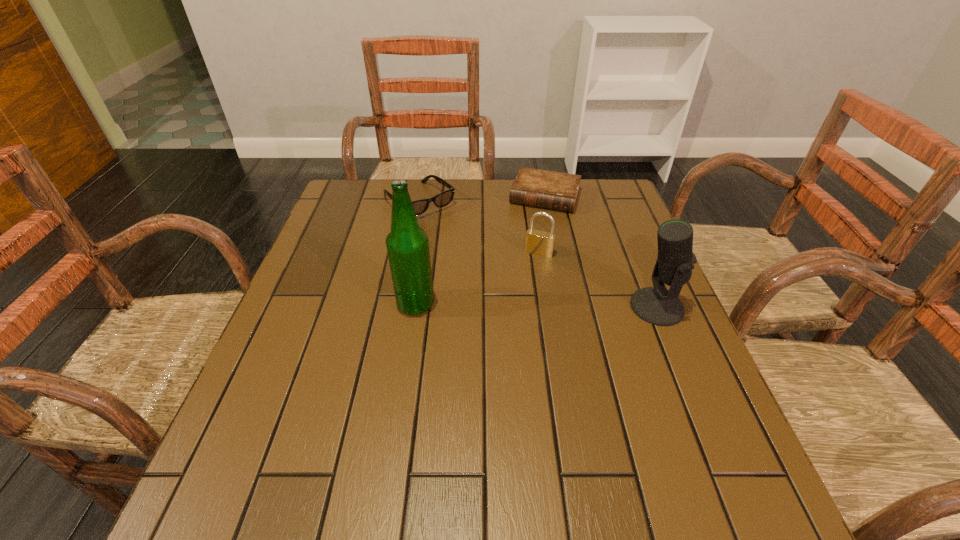
What are the coordinates of `unoccupied position between the shortest object and the spectacles` in the screenshot? It's located at (482, 200).

The width and height of the screenshot is (960, 540). I want to click on empty space between the third tallest object and the shortest object, so click(542, 225).

The image size is (960, 540). In order to click on free area in between the beer bottle and the rightmost object in this screenshot , I will do `click(536, 306)`.

What are the coordinates of `object that stands as the closest to the padlock` in the screenshot? It's located at (546, 189).

The image size is (960, 540). I want to click on the third closest object to the microphone, so click(407, 245).

At what (x,y) coordinates should I click in order to perform the action: click on vacant space that satisfies the following two spatial constraints: 1. on the front side of the diary; 2. on the left side of the microphone. Please return your answer as a coordinate pair (x, y). The width and height of the screenshot is (960, 540). Looking at the image, I should click on (567, 307).

This screenshot has width=960, height=540. Identify the location of vacant space that satisfies the following two spatial constraints: 1. on the front side of the spectacles; 2. on the left side of the rightmost object. (399, 307).